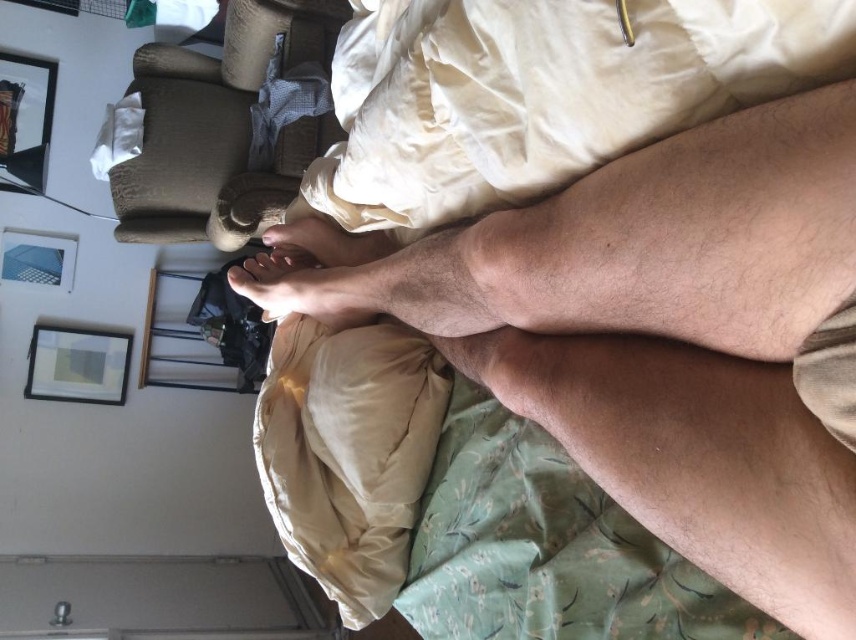
Question: Among these objects, which one is farthest from the camera?

Choices:
 (A) wooden picture frame at upper left
 (B) matte wooden picture frame at upper left
 (C) skinny barefoot at center
 (D) metallic silver picture frame at upper left

Answer: (B)

Question: Can you confirm if wooden picture frame at upper left is smaller than skinny barefoot at center?

Choices:
 (A) no
 (B) yes

Answer: (A)

Question: Which object is the closest to the skinny barefoot at center?

Choices:
 (A) metallic silver picture frame at upper left
 (B) hair-covered skin at center
 (C) matte wooden picture frame at upper left

Answer: (B)

Question: Does metallic silver picture frame at upper left have a smaller size compared to skinny barefoot at center?

Choices:
 (A) no
 (B) yes

Answer: (B)

Question: Which is farther from the hair-covered skin at center?

Choices:
 (A) wooden picture frame at upper left
 (B) matte wooden picture frame at upper left

Answer: (A)

Question: Where is hair-covered skin at center located in relation to metallic silver picture frame at upper left in the image?

Choices:
 (A) below
 (B) above

Answer: (A)